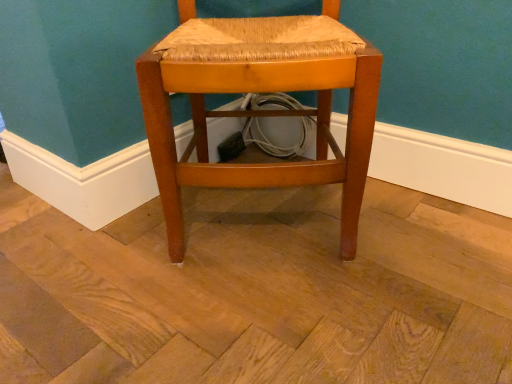
This screenshot has width=512, height=384. I want to click on vacant space to the left of matte wood chair at center, so click(95, 252).